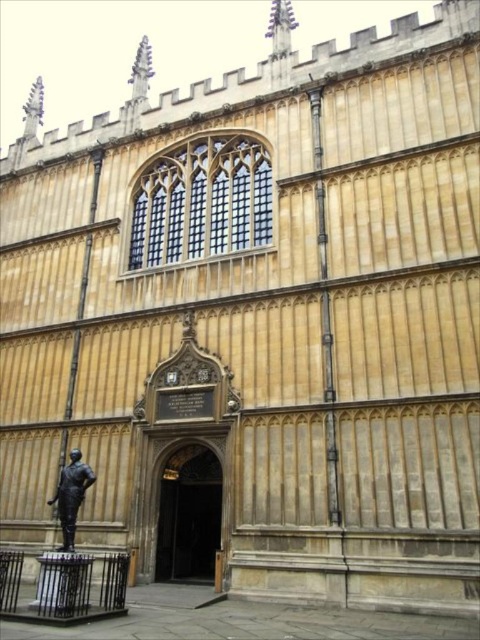
Question: Among these points, which one is nearest to the camera?

Choices:
 (A) (95, 477)
 (B) (192, 524)

Answer: (A)

Question: Among these points, which one is farthest from the camera?

Choices:
 (A) (68, 499)
 (B) (212, 579)

Answer: (B)

Question: Can you confirm if dark brown wooden door at center is positioned to the right of bronze statue at lower left?

Choices:
 (A) yes
 (B) no

Answer: (A)

Question: Is dark brown wooden door at center above bronze statue at lower left?

Choices:
 (A) yes
 (B) no

Answer: (B)

Question: Which object appears farthest from the camera in this image?

Choices:
 (A) dark brown wooden door at center
 (B) bronze statue at lower left

Answer: (A)

Question: Does dark brown wooden door at center appear on the right side of bronze statue at lower left?

Choices:
 (A) yes
 (B) no

Answer: (A)